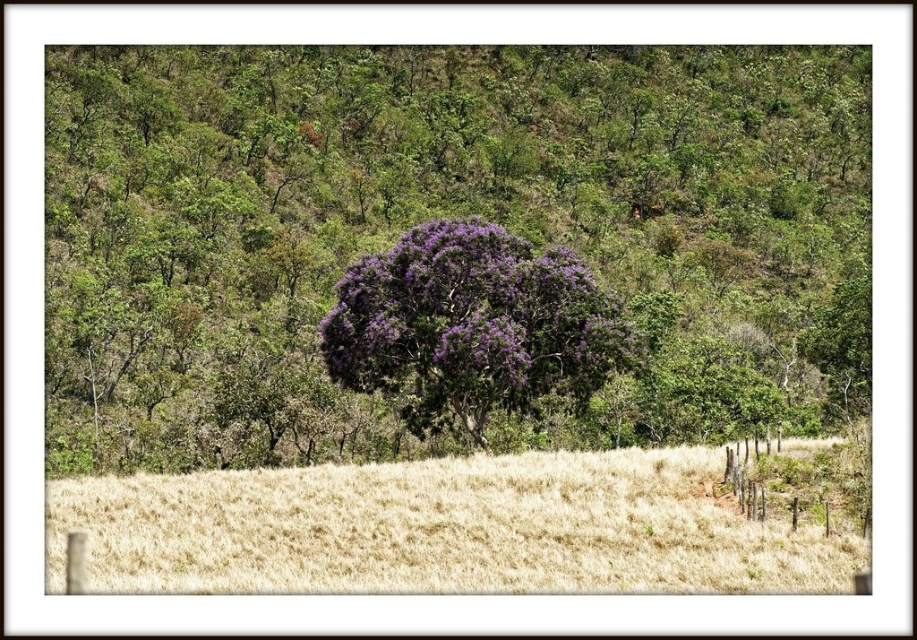
Question: Which point is closer to the camera taking this photo?

Choices:
 (A) (170, 285)
 (B) (594, 348)

Answer: (B)

Question: Can you confirm if purple leafy tree at center is positioned to the right of purple leafy bush at center?

Choices:
 (A) yes
 (B) no

Answer: (A)

Question: Can you confirm if dry straw field at lower center is positioned above purple leafy bush at center?

Choices:
 (A) yes
 (B) no

Answer: (B)

Question: Which object is closer to the camera taking this photo?

Choices:
 (A) purple leafy bush at center
 (B) purple leafy tree at center

Answer: (A)

Question: Does purple leafy tree at center have a larger size compared to purple leafy bush at center?

Choices:
 (A) no
 (B) yes

Answer: (B)

Question: Which point is farther from the camera taking this photo?

Choices:
 (A) (242, 49)
 (B) (315, 499)

Answer: (A)